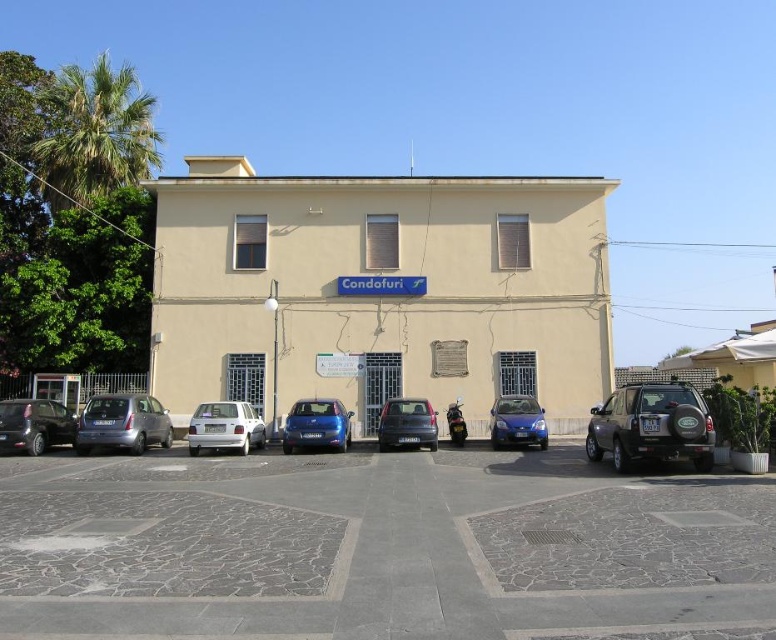
You are standing at the entrance of the Condofuri building and want to park your car in the gray stone parking lot at center. Where exactly should you position your car to align with the parking spot marked at point (380, 547)?

The gray stone parking lot at center is located at point (380, 547), so you should position your car precisely at that coordinate to align with the parking spot.

You are a delivery driver who needs to park your vehicle in front of the Condofuri building. You have a dark gray metallic suv at right and a matte black car at center. Which vehicle is closer to the left side of the building?

The matte black car at center is closer to the left side of the building because the dark gray metallic suv at right is positioned on the right side of it.

You are a delivery person trying to park your matte black car at center in the gray stone parking lot at center. Can you park your car there?

The gray stone parking lot at center is positioned over matte black car at center, so the car is already occupying the parking lot. You cannot park there.